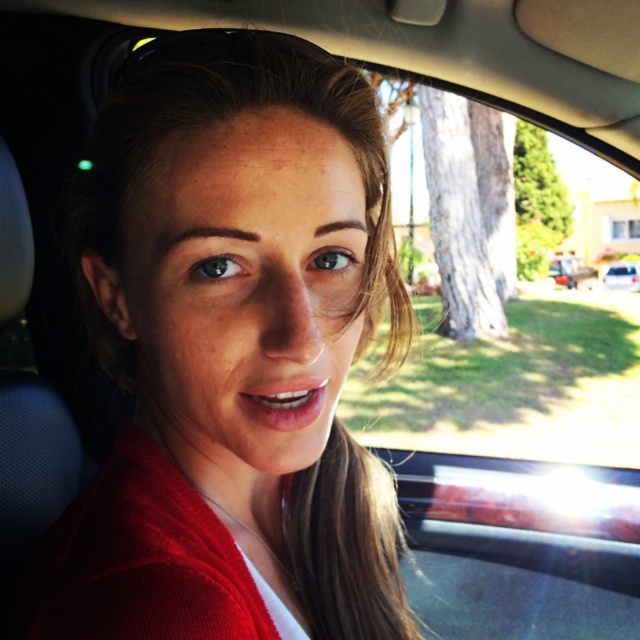
Who is positioned more to the left, matte red sweater at center or white glossy car at lower right?

matte red sweater at center

Does matte red sweater at center have a lesser width compared to white glossy car at lower right?

Incorrect, matte red sweater at center's width is not less than white glossy car at lower right's.

Is point (160, 67) positioned before point (632, 273)?

That is True.

I want to click on matte red sweater at center, so (234, 353).

Is metallic silver car at right smaller than white glossy car at lower right?

Incorrect, metallic silver car at right is not smaller in size than white glossy car at lower right.

Which is in front, point (584, 269) or point (628, 266)?

Point (628, 266)

Locate an element on the screen. metallic silver car at right is located at coordinates (570, 272).

Does matte red sweater at center have a lesser width compared to metallic silver car at right?

Indeed, matte red sweater at center has a lesser width compared to metallic silver car at right.

How far apart are matte red sweater at center and metallic silver car at right?

matte red sweater at center is 4.39 meters away from metallic silver car at right.

Is point (184, 220) farther from camera compared to point (573, 269)?

No, (184, 220) is closer to viewer.

Where is `matte red sweater at center`? The height and width of the screenshot is (640, 640). matte red sweater at center is located at coordinates (234, 353).